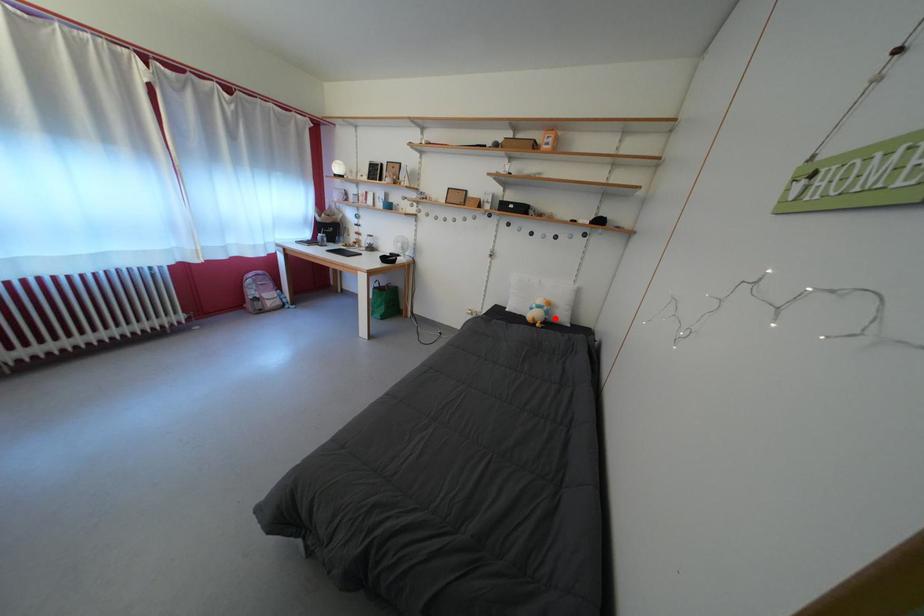
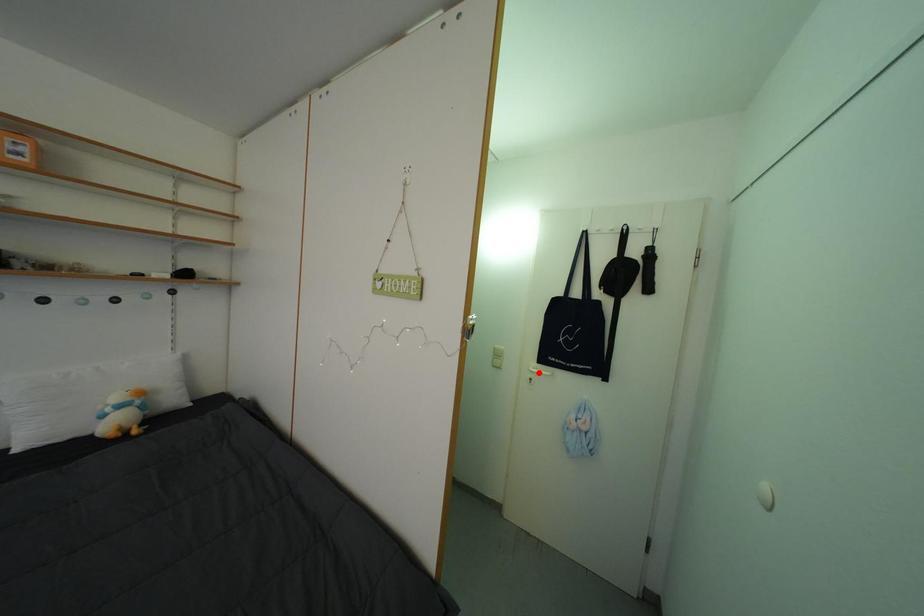
I am providing you with two images of the same scene from different viewpoints. A red point is marked on the first image and another point is marked on the second image. Are the points marked in image1 and image2 representing the same 3D position?

No